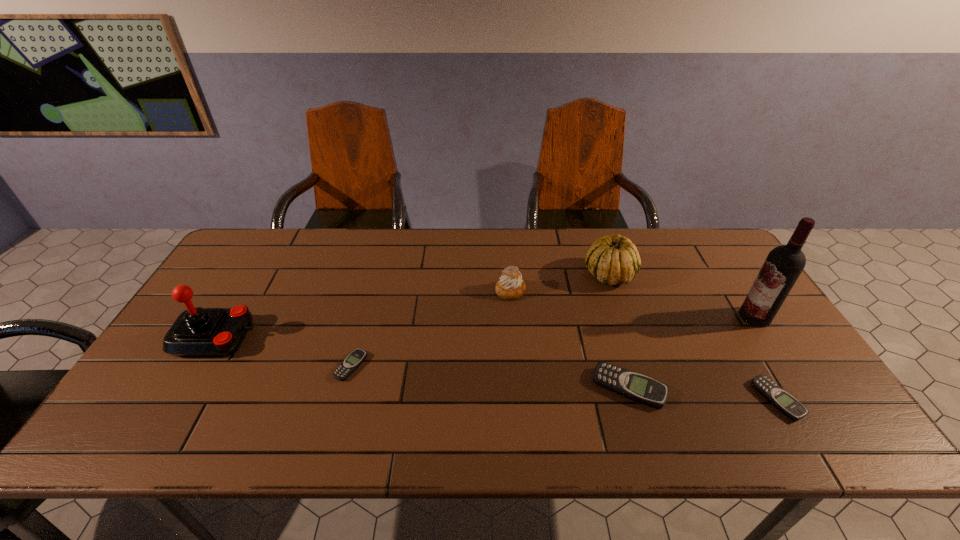
To ensure equal spacing by inserting another beeper among them, please point out a vacant spot for this new beeper. Please provide its 2D coordinates. Your answer should be formatted as a tuple, i.e. [(x, y)], where the tuple contains the x and y coordinates of a point satisfying the conditions above.

[(487, 376)]